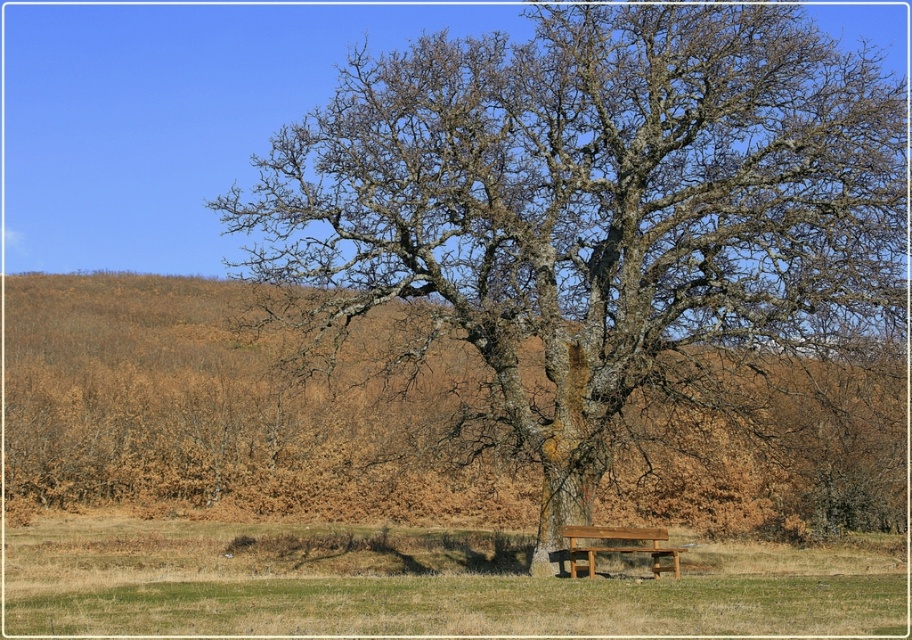
You are a gardener who needs to place a 3 meter long fence between the smooth bark tree at center and the brown dry grass at center. Can you fit the fence between them without bending it?

The distance between the smooth bark tree at center and the brown dry grass at center is 2.92 meters. Since the fence is 3 meters long, it is slightly too long to fit between them without bending.

You are sitting on the brown wooden bench at center and want to touch the smooth bark tree at center. Which direction should you reach your hand to touch it?

The smooth bark tree at center is to the left of the brown wooden bench at center, so you should reach your hand to the left to touch it.

You are a gardener who wants to plant new flowers in the area between the brown dry grass at center and the green grass at lower center. Which grass area should you avoid planting in to ensure the flowers get enough sunlight?

The brown dry grass at center is taller than the green grass at lower center, so planting flowers in the brown dry grass at center may block sunlight due to its height, making the green grass at lower center a better choice for planting.